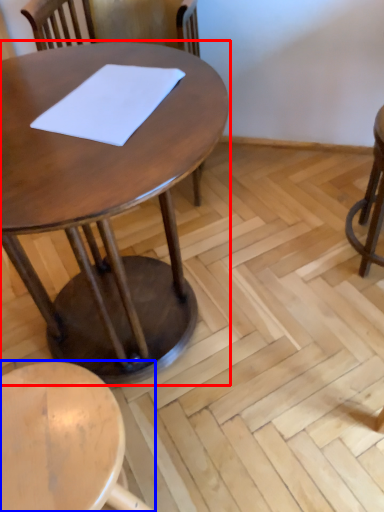
Question: Among these objects, which one is nearest to the camera, table (highlighted by a red box) or stool (highlighted by a blue box)?

Choices:
 (A) table
 (B) stool

Answer: (A)